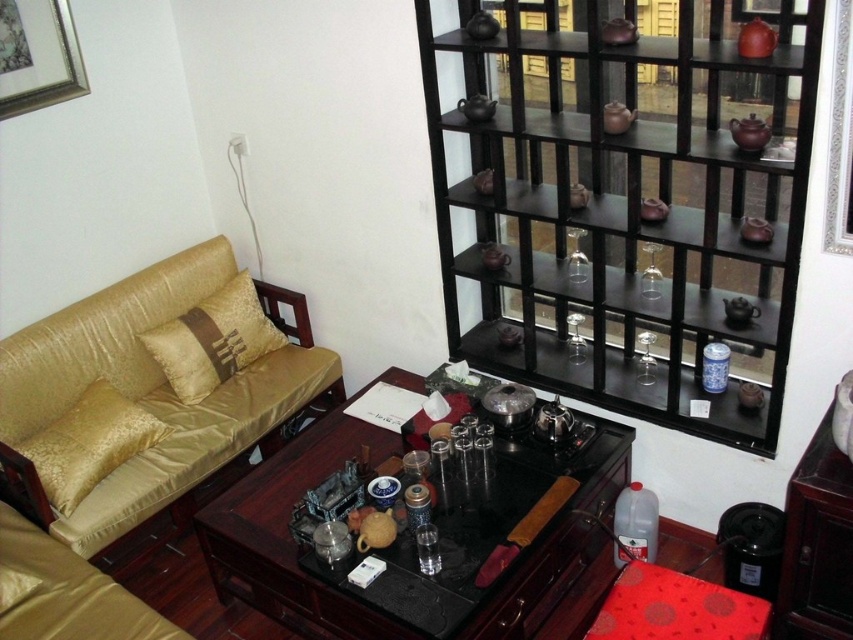
Question: Where is gold silk couch at left located in relation to clear plastic bottle at lower right in the image?

Choices:
 (A) right
 (B) left

Answer: (B)

Question: Can you confirm if gold silk pillow at left is positioned below gold satin pillow at left?

Choices:
 (A) no
 (B) yes

Answer: (B)

Question: Among these points, which one is nearest to the camera?

Choices:
 (A) (273, 348)
 (B) (622, 506)

Answer: (B)

Question: Which point is closer to the camera?

Choices:
 (A) (195, 380)
 (B) (590, 541)
 (C) (706, 336)
 (D) (154, 435)

Answer: (B)

Question: Which point appears farthest from the camera in this image?

Choices:
 (A) 648,518
 (B) 256,333
 (C) 402,545

Answer: (B)

Question: Does black wood shelf at upper right have a lesser width compared to gold silk couch at left?

Choices:
 (A) no
 (B) yes

Answer: (A)